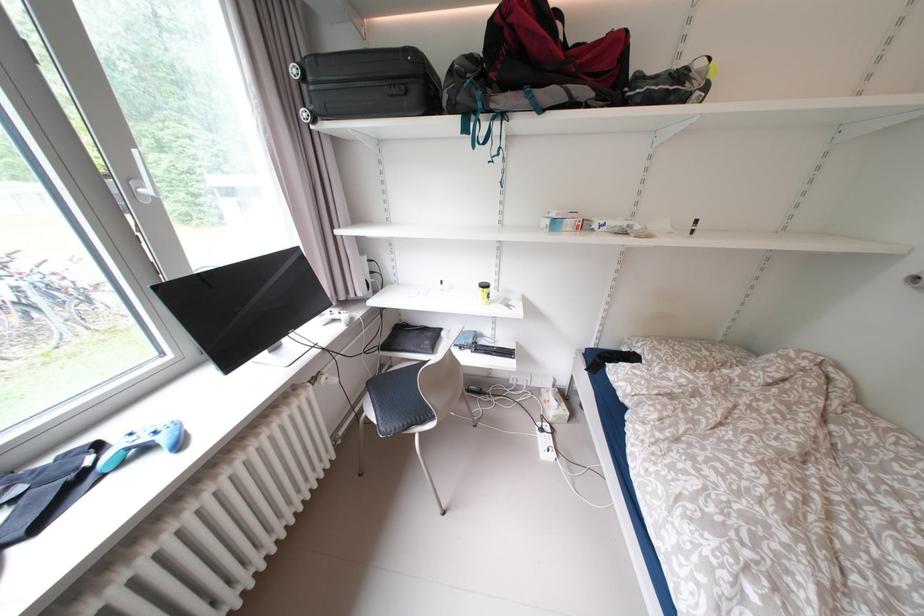
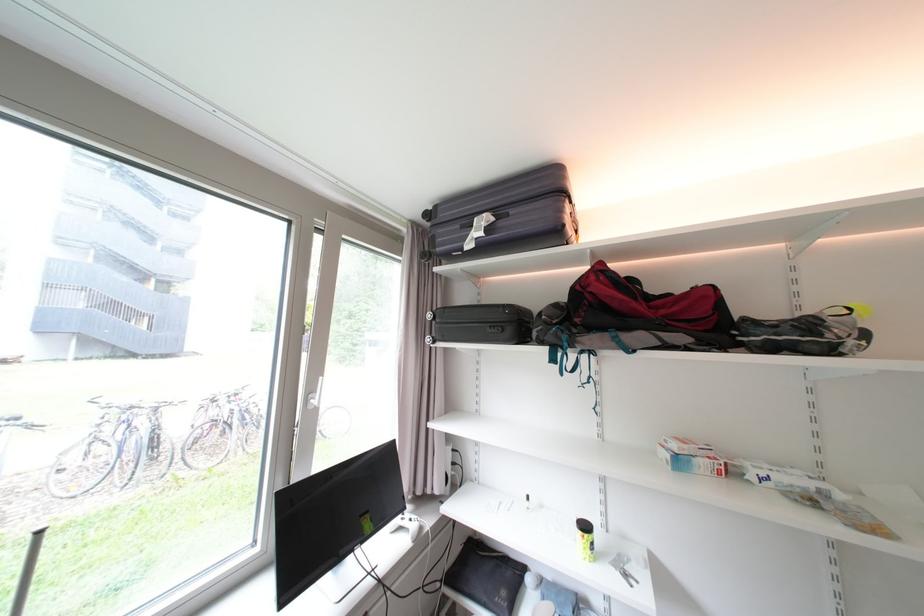
Find the pixel in the second image that matches (x=388, y=341) in the first image.

(455, 567)